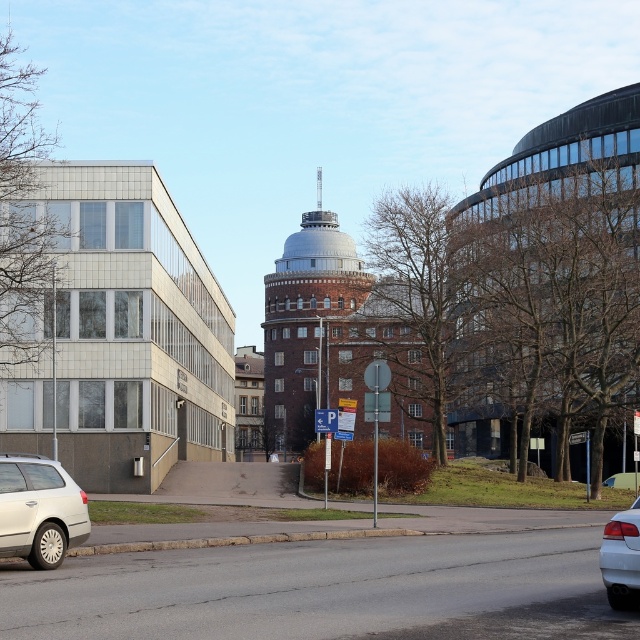
Based on the photo, does red brick tower at center have a smaller size compared to white glossy sedan at lower right?

Actually, red brick tower at center might be larger than white glossy sedan at lower right.

Can you confirm if red brick tower at center is positioned to the right of white glossy sedan at lower right?

In fact, red brick tower at center is to the left of white glossy sedan at lower right.

This screenshot has height=640, width=640. In order to click on red brick tower at center in this screenshot , I will do `click(307, 324)`.

Who is more distant from viewer, (38, 544) or (614, 522)?

The point (38, 544) is behind.

Does point (17, 522) lie behind point (624, 589)?

Yes, it is.

Locate an element on the screen. Image resolution: width=640 pixels, height=640 pixels. silver metallic station wagon at lower left is located at coordinates tap(38, 509).

Can you confirm if red brick tower at center is wider than silver metallic station wagon at lower left?

Yes, red brick tower at center is wider than silver metallic station wagon at lower left.

Does red brick tower at center come behind silver metallic station wagon at lower left?

Yes, it is.

Where is `red brick tower at center`? This screenshot has width=640, height=640. red brick tower at center is located at coordinates (307, 324).

Locate an element on the screen. The image size is (640, 640). red brick tower at center is located at coordinates (307, 324).